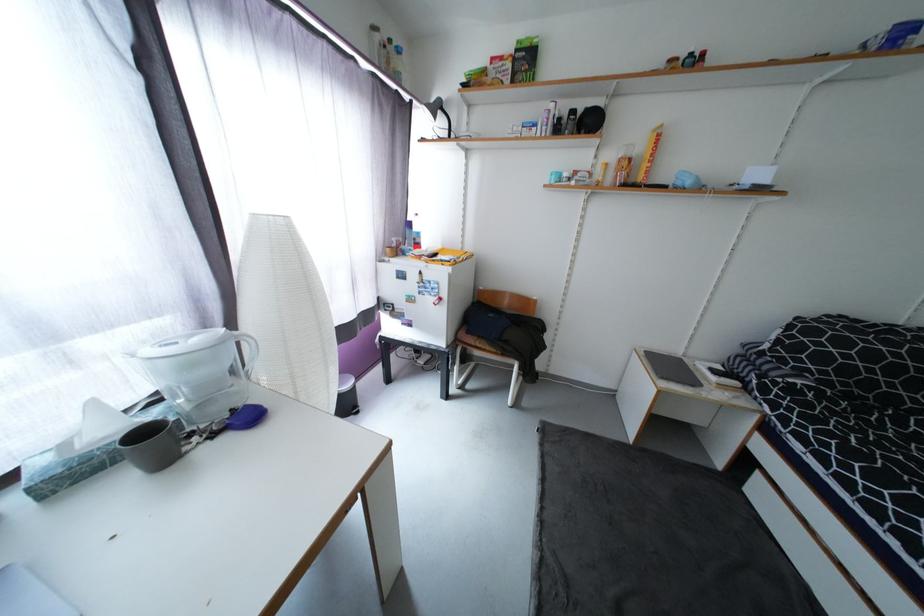
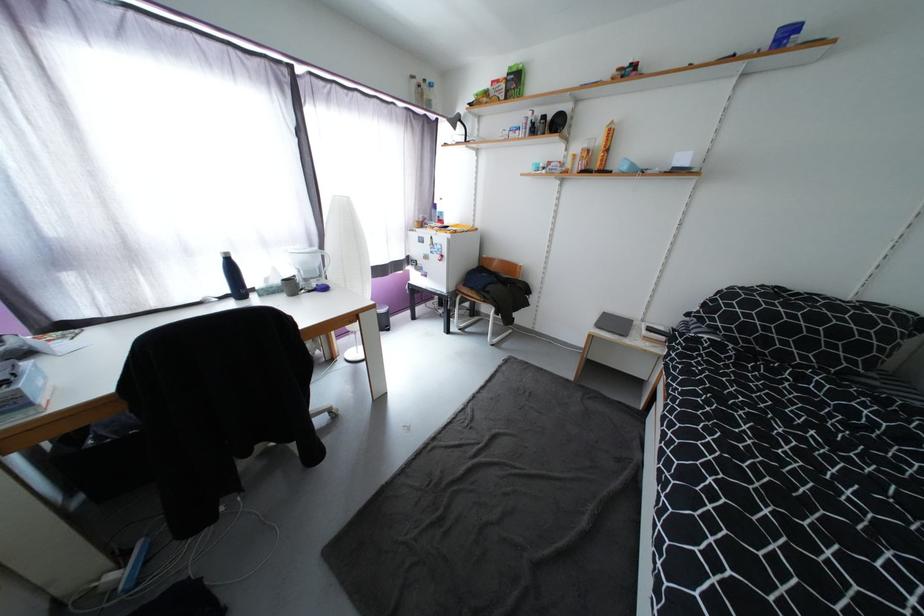
From the picture: What movement of the cameraman would produce the second image?

The movement direction of the cameraman is right, backward.